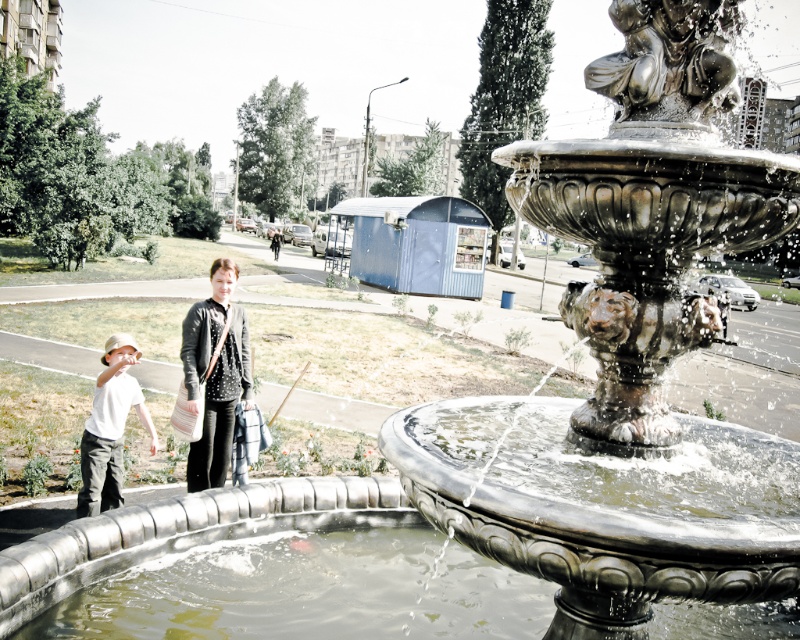
You are a photographer standing at the edge of the paved area. You want to capture a photo where the dark gray sweater at center is visible above the clear water at fountain center. Is this possible based on their heights?

The clear water at fountain center is shorter than dark gray sweater at center, so yes, the dark gray sweater at center will be visible above the clear water at fountain center in the photo.

You are a photographer trying to capture a closeup of the clear water at fountain center without the dark gray sweater at center blocking the view. Is this possible given their positions?

The clear water at fountain center is positioned under the dark gray sweater at center, so it is blocked by the sweater and cannot be captured without moving the sweater or changing the camera angle.